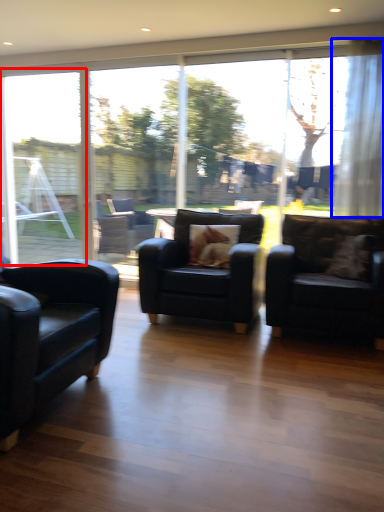
Question: Which object appears farthest to the camera in this image, window frame (highlighted by a red box) or curtain (highlighted by a blue box)?

Choices:
 (A) window frame
 (B) curtain

Answer: (A)